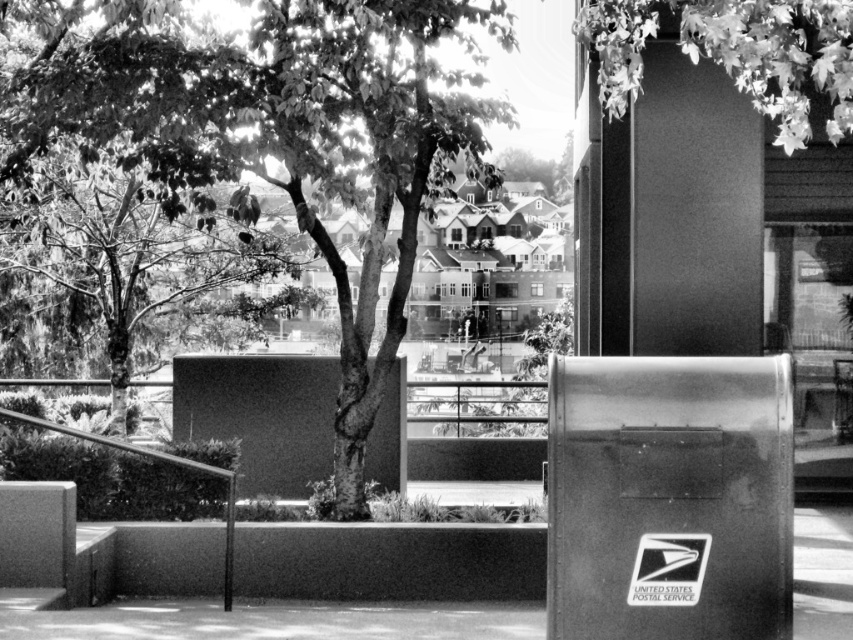
Does smooth green tree at center have a larger size compared to leaves at upper right?

Indeed, smooth green tree at center has a larger size compared to leaves at upper right.

Who is more forward, (x=397, y=28) or (x=811, y=12)?

Point (x=811, y=12)

This screenshot has height=640, width=853. Find the location of `smooth green tree at center`. smooth green tree at center is located at coordinates (288, 138).

Who is positioned more to the left, smooth concrete pavement at lower center or leaves at upper right?

smooth concrete pavement at lower center is more to the left.

Does smooth concrete pavement at lower center appear on the left side of leaves at upper right?

Indeed, smooth concrete pavement at lower center is positioned on the left side of leaves at upper right.

Between point (381, 636) and point (598, 74), which one is positioned behind?

The point (598, 74) is behind.

Identify the location of smooth concrete pavement at lower center. (259, 620).

Can you confirm if smooth green tree at upper left is positioned above leaves at upper right?

Incorrect, smooth green tree at upper left is not positioned above leaves at upper right.

Where is `smooth green tree at upper left`? This screenshot has height=640, width=853. smooth green tree at upper left is located at coordinates coord(126,246).

Which is behind, point (123, 275) or point (756, 35)?

The point (123, 275) is more distant.

The height and width of the screenshot is (640, 853). Identify the location of smooth green tree at upper left. (126, 246).